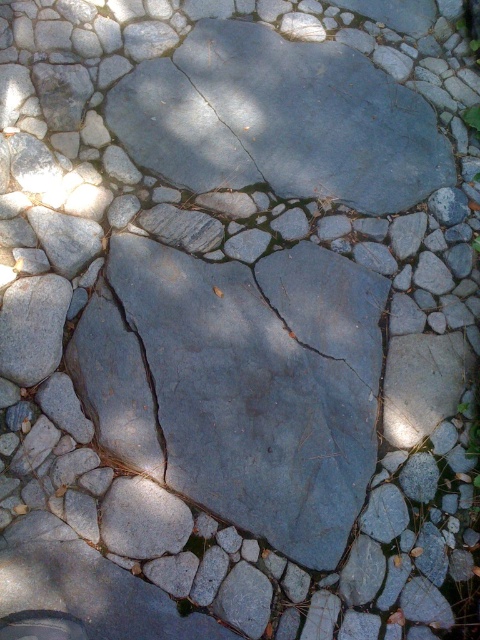
You are a gardener inspecting the stone pathway. You notice the gray rough stone at center and the gray rough stone crack at center. Which of these two has a greater height?

The gray rough stone at center is taller than the gray rough stone crack at center.

You are a gardener trying to repair the stone pathway. You have a gray rough stone at center and a gray rough stone crack at center. Which one has a larger width?

The gray rough stone at center is wider than the gray rough stone crack at center according to the description.

You are standing on the stone pathway and looking at two points marked on the image. Which point, point at coordinate (197, 262) or point at coordinate (128, 349), is closer to you?

Point at coordinate (128, 349) is closer to you because it is less further to the camera than point at coordinate (197, 262).